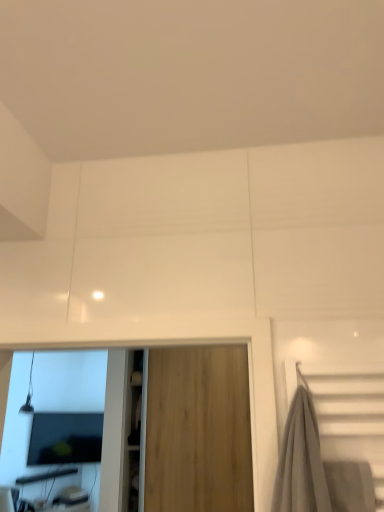
Question: Is wooden door at center situated inside matte black monitor at lower left or outside?

Choices:
 (A) outside
 (B) inside

Answer: (A)

Question: Visually, is wooden door at center positioned to the left or to the right of matte black monitor at lower left?

Choices:
 (A) left
 (B) right

Answer: (B)

Question: In terms of size, does wooden door at center appear bigger or smaller than matte black monitor at lower left?

Choices:
 (A) small
 (B) big

Answer: (B)

Question: Considering the positions of matte black monitor at lower left and wooden door at center in the image, is matte black monitor at lower left wider or thinner than wooden door at center?

Choices:
 (A) thin
 (B) wide

Answer: (A)

Question: Is matte black monitor at lower left situated inside wooden door at center or outside?

Choices:
 (A) outside
 (B) inside

Answer: (A)

Question: From a real-world perspective, is matte black monitor at lower left above or below wooden door at center?

Choices:
 (A) above
 (B) below

Answer: (B)

Question: From the image's perspective, is matte black monitor at lower left positioned above or below wooden door at center?

Choices:
 (A) below
 (B) above

Answer: (A)